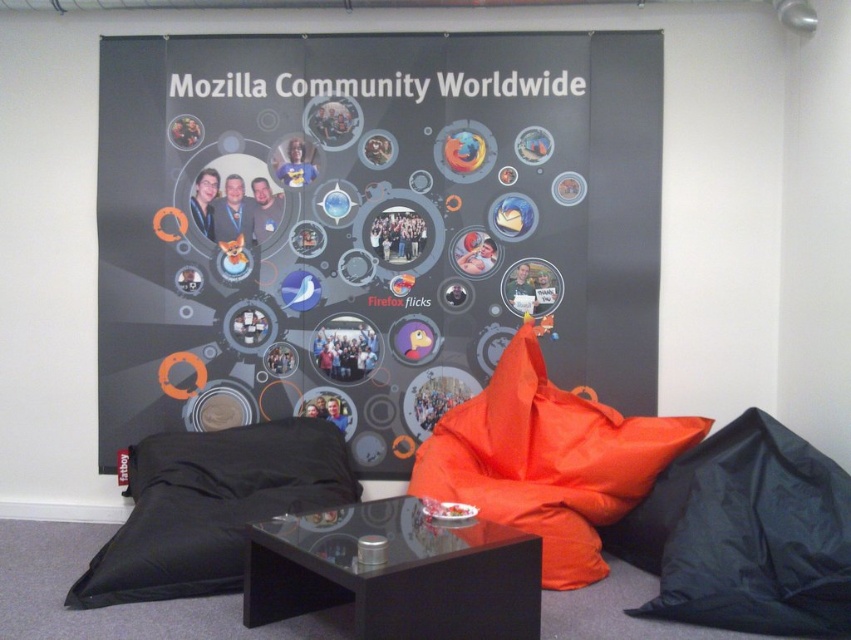
Question: Which is nearer to the matte black poster at center?

Choices:
 (A) orange fabric bean bag at center
 (B) black fabric beanbag at lower right
 (C) black fabric pillow at lower left

Answer: (A)

Question: Which point is farther from the camera taking this photo?

Choices:
 (A) (621, 448)
 (B) (111, 116)

Answer: (B)

Question: From the image, what is the correct spatial relationship of matte black poster at center in relation to black fabric beanbag at lower right?

Choices:
 (A) above
 (B) below

Answer: (A)

Question: Is black fabric beanbag at lower right below orange fabric bean bag at center?

Choices:
 (A) yes
 (B) no

Answer: (A)

Question: Which point is closer to the camera?

Choices:
 (A) (760, 440)
 (B) (641, 440)

Answer: (A)

Question: Does black fabric beanbag at lower right have a smaller size compared to black fabric pillow at lower left?

Choices:
 (A) no
 (B) yes

Answer: (B)